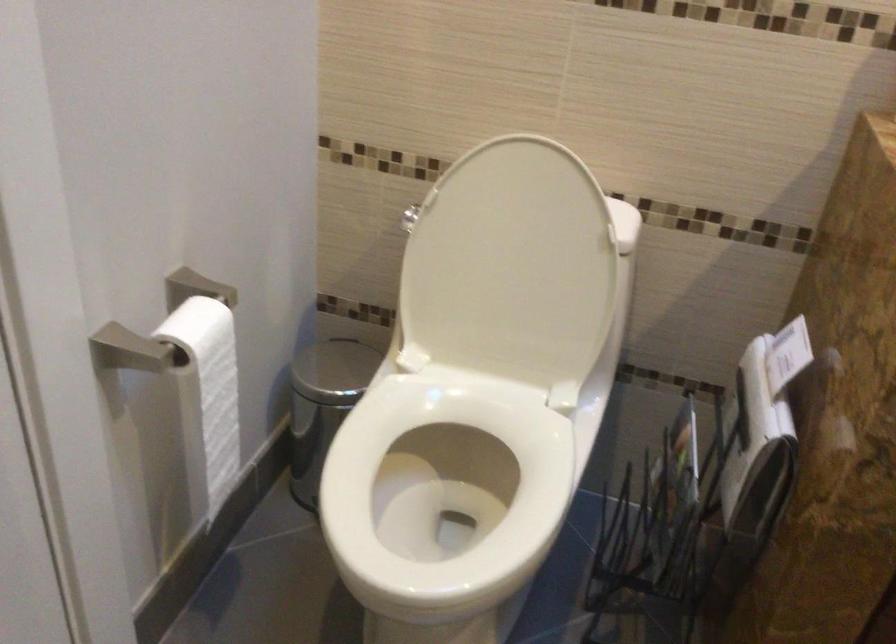
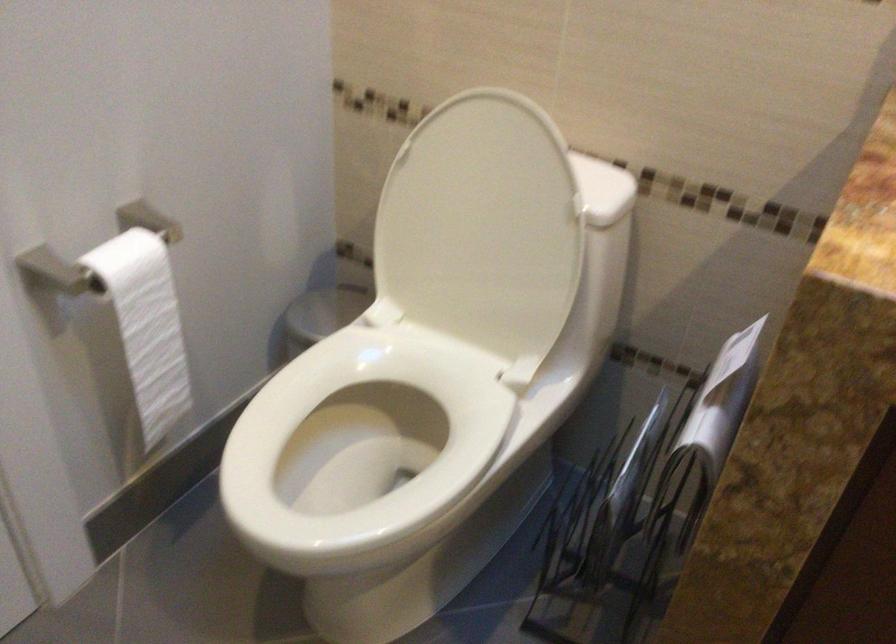
The point at [407,484] is marked in the first image. Where is the corresponding point in the second image?

(363, 438)